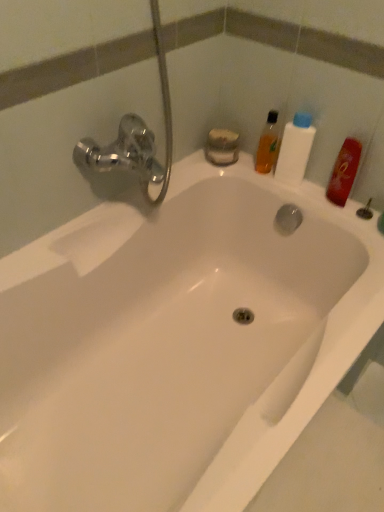
Identify the location of red matte bottle at upper right, arranged as the second mouthwash when viewed from the left. The height and width of the screenshot is (512, 384). (344, 172).

Measure the distance between red matte bottle at upper right, which appears as the 1th mouthwash when viewed from the right, and camera.

They are 3.52 feet apart.

Locate an element on the screen. Image resolution: width=384 pixels, height=512 pixels. translucent orange bottle at upper right, which is counted as the 2th mouthwash, starting from the right is located at coordinates (267, 144).

The width and height of the screenshot is (384, 512). I want to click on red matte bottle at upper right, which appears as the 1th mouthwash when viewed from the right, so click(x=344, y=172).

Which is more to the left, white plastic bottle at upper right or red matte bottle at upper right, which appears as the 1th mouthwash when viewed from the right?

white plastic bottle at upper right is more to the left.

Is white plastic bottle at upper right aimed at red matte bottle at upper right, which appears as the 1th mouthwash when viewed from the right?

No, white plastic bottle at upper right is not facing towards red matte bottle at upper right, which appears as the 1th mouthwash when viewed from the right.

Could you measure the distance between white plastic bottle at upper right and red matte bottle at upper right, arranged as the second mouthwash when viewed from the left?

12.01 centimeters.

Based on their sizes in the image, would you say white plastic bottle at upper right is bigger or smaller than red matte bottle at upper right, arranged as the second mouthwash when viewed from the left?

white plastic bottle at upper right is bigger than red matte bottle at upper right, arranged as the second mouthwash when viewed from the left.

Does white plastic bottle at upper right have a greater width compared to translucent orange bottle at upper right, which is counted as the 2th mouthwash, starting from the right?

Correct, the width of white plastic bottle at upper right exceeds that of translucent orange bottle at upper right, which is counted as the 2th mouthwash, starting from the right.

Can you confirm if white plastic bottle at upper right is positioned to the left of translucent orange bottle at upper right, which is counted as the 2th mouthwash, starting from the right?

In fact, white plastic bottle at upper right is to the right of translucent orange bottle at upper right, which is counted as the 2th mouthwash, starting from the right.

Does white plastic bottle at upper right come behind translucent orange bottle at upper right, which is counted as the 2th mouthwash, starting from the right?

No, it is in front of translucent orange bottle at upper right, which is counted as the 2th mouthwash, starting from the right.

From a real-world perspective, relative to white plastic bottle at upper right, is red matte bottle at upper right, arranged as the second mouthwash when viewed from the left, vertically above or below?

In terms of real-world spatial position, red matte bottle at upper right, arranged as the second mouthwash when viewed from the left, is below white plastic bottle at upper right.

Consider the image. From the image's perspective, between red matte bottle at upper right, arranged as the second mouthwash when viewed from the left, and white plastic bottle at upper right, which one is located above?

white plastic bottle at upper right.

Measure the distance between red matte bottle at upper right, which appears as the 1th mouthwash when viewed from the right, and white plastic bottle at upper right.

12.01 centimeters.

Between red matte bottle at upper right, which appears as the 1th mouthwash when viewed from the right, and white plastic bottle at upper right, which one appears on the right side from the viewer's perspective?

From the viewer's perspective, red matte bottle at upper right, which appears as the 1th mouthwash when viewed from the right, appears more on the right side.

Is translucent orange bottle at upper right, which is counted as the 2th mouthwash, starting from the right, closer to the viewer compared to red matte bottle at upper right, arranged as the second mouthwash when viewed from the left?

No, translucent orange bottle at upper right, which is counted as the 2th mouthwash, starting from the right, is further to the viewer.

Considering the sizes of objects translucent orange bottle at upper right, which is counted as the 2th mouthwash, starting from the right, and red matte bottle at upper right, which appears as the 1th mouthwash when viewed from the right, in the image provided, who is thinner, translucent orange bottle at upper right, which is counted as the 2th mouthwash, starting from the right, or red matte bottle at upper right, which appears as the 1th mouthwash when viewed from the right,?

red matte bottle at upper right, which appears as the 1th mouthwash when viewed from the right.

What's the angular difference between translucent orange bottle at upper right, placed as the first mouthwash when sorted from left to right, and red matte bottle at upper right, which appears as the 1th mouthwash when viewed from the right,'s facing directions?

0.000174 degrees separate the facing orientations of translucent orange bottle at upper right, placed as the first mouthwash when sorted from left to right, and red matte bottle at upper right, which appears as the 1th mouthwash when viewed from the right.

In terms of size, does translucent orange bottle at upper right, which is counted as the 2th mouthwash, starting from the right, appear bigger or smaller than red matte bottle at upper right, arranged as the second mouthwash when viewed from the left?

In the image, translucent orange bottle at upper right, which is counted as the 2th mouthwash, starting from the right, appears to be smaller than red matte bottle at upper right, arranged as the second mouthwash when viewed from the left.

Do you think translucent orange bottle at upper right, which is counted as the 2th mouthwash, starting from the right, is within white plastic bottle at upper right, or outside of it?

translucent orange bottle at upper right, which is counted as the 2th mouthwash, starting from the right, is not inside white plastic bottle at upper right, it's outside.

Are translucent orange bottle at upper right, placed as the first mouthwash when sorted from left to right, and white plastic bottle at upper right located far from each other?

That's not correct — translucent orange bottle at upper right, placed as the first mouthwash when sorted from left to right, is a little close to white plastic bottle at upper right.

Does translucent orange bottle at upper right, which is counted as the 2th mouthwash, starting from the right, have a greater width compared to white plastic bottle at upper right?

Incorrect, the width of translucent orange bottle at upper right, which is counted as the 2th mouthwash, starting from the right, does not surpass that of white plastic bottle at upper right.

Can you tell me how much translucent orange bottle at upper right, placed as the first mouthwash when sorted from left to right, and white plastic bottle at upper right differ in facing direction?

0.000172 degrees.

Is red matte bottle at upper right, which appears as the 1th mouthwash when viewed from the right, positioned with its back to translucent orange bottle at upper right, which is counted as the 2th mouthwash, starting from the right?

red matte bottle at upper right, which appears as the 1th mouthwash when viewed from the right, does not have its back to translucent orange bottle at upper right, which is counted as the 2th mouthwash, starting from the right.

Who is taller, red matte bottle at upper right, which appears as the 1th mouthwash when viewed from the right, or translucent orange bottle at upper right, which is counted as the 2th mouthwash, starting from the right?

With more height is translucent orange bottle at upper right, which is counted as the 2th mouthwash, starting from the right.

You are a GUI agent. You are given a task and a screenshot of the screen. Output one action in this format:
    pyautogui.click(x=<x>, y=<y>)
    Task: Click on the mouthwash in front of the translucent orange bottle at upper right, which is counted as the 2th mouthwash, starting from the right
    This screenshot has width=384, height=512.
    Given the screenshot: What is the action you would take?
    pyautogui.click(x=344, y=172)

I want to click on cleaning product on the left of red matte bottle at upper right, which appears as the 1th mouthwash when viewed from the right, so click(295, 149).

This screenshot has width=384, height=512. Find the location of `cleaning product on the right of the translucent orange bottle at upper right, placed as the first mouthwash when sorted from left to right`. cleaning product on the right of the translucent orange bottle at upper right, placed as the first mouthwash when sorted from left to right is located at coordinates (295, 149).

Estimate the real-world distances between objects in this image. Which object is further from red matte bottle at upper right, arranged as the second mouthwash when viewed from the left, translucent orange bottle at upper right, placed as the first mouthwash when sorted from left to right, or white plastic bottle at upper right?

translucent orange bottle at upper right, placed as the first mouthwash when sorted from left to right, lies further to red matte bottle at upper right, arranged as the second mouthwash when viewed from the left, than the other object.

From the picture: When comparing their distances from red matte bottle at upper right, arranged as the second mouthwash when viewed from the left, does white plastic bottle at upper right or translucent orange bottle at upper right, which is counted as the 2th mouthwash, starting from the right, seem closer?

white plastic bottle at upper right.

Consider the image. Estimate the real-world distances between objects in this image. Which object is closer to translucent orange bottle at upper right, which is counted as the 2th mouthwash, starting from the right, red matte bottle at upper right, which appears as the 1th mouthwash when viewed from the right, or white plastic bottle at upper right?

white plastic bottle at upper right.

In the scene shown: Considering their positions, is translucent orange bottle at upper right, placed as the first mouthwash when sorted from left to right, positioned further to white plastic bottle at upper right than red matte bottle at upper right, which appears as the 1th mouthwash when viewed from the right?

The object further to white plastic bottle at upper right is red matte bottle at upper right, which appears as the 1th mouthwash when viewed from the right.

Estimate the real-world distances between objects in this image. Which object is closer to white plastic bottle at upper right, red matte bottle at upper right, which appears as the 1th mouthwash when viewed from the right, or translucent orange bottle at upper right, placed as the first mouthwash when sorted from left to right?

translucent orange bottle at upper right, placed as the first mouthwash when sorted from left to right, is positioned closer to the anchor white plastic bottle at upper right.

Based on their spatial positions, is white plastic bottle at upper right or red matte bottle at upper right, arranged as the second mouthwash when viewed from the left, closer to translucent orange bottle at upper right, which is counted as the 2th mouthwash, starting from the right?

Among the two, white plastic bottle at upper right is located nearer to translucent orange bottle at upper right, which is counted as the 2th mouthwash, starting from the right.

The height and width of the screenshot is (512, 384). Find the location of `cleaning product situated between translucent orange bottle at upper right, which is counted as the 2th mouthwash, starting from the right, and red matte bottle at upper right, arranged as the second mouthwash when viewed from the left, from left to right`. cleaning product situated between translucent orange bottle at upper right, which is counted as the 2th mouthwash, starting from the right, and red matte bottle at upper right, arranged as the second mouthwash when viewed from the left, from left to right is located at coordinates (295, 149).